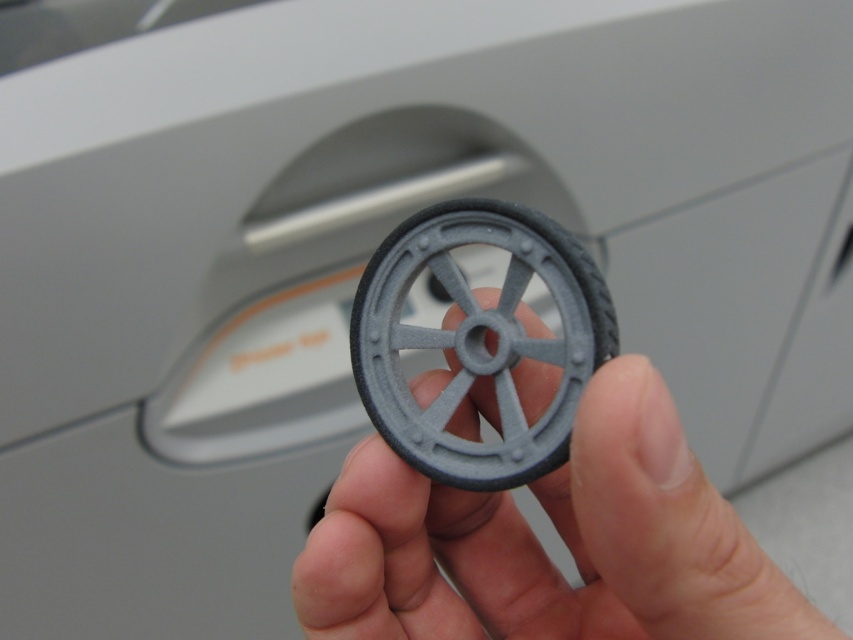
Is point (701, 637) positioned behind point (383, 436)?

No, it is in front of (383, 436).

Between gray matte wheel at center and matte gray wheel at center, which one has more height?

Standing taller between the two is gray matte wheel at center.

Does point (607, 404) come farther from viewer compared to point (445, 484)?

No, it is not.

At what (x,y) coordinates should I click in order to perform the action: click on gray matte wheel at center. Please return your answer as a coordinate pair (x, y). Looking at the image, I should click on (541, 547).